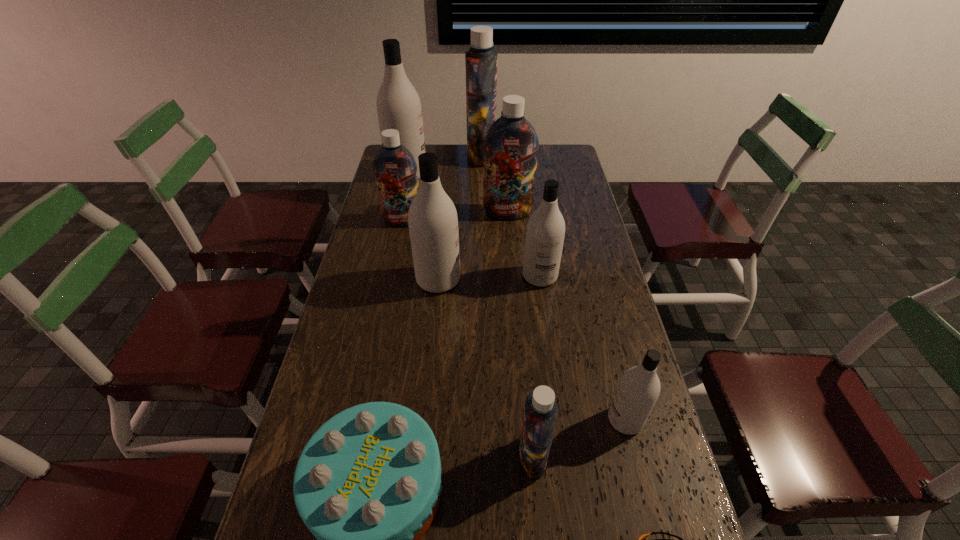
You are a GUI agent. You are given a task and a screenshot of the screen. Output one action in this format:
    pyautogui.click(x=<x>, y=<y>)
    Task: Click on the vacant space situated 0.350m on the front label of the nearest blue shampoo
    
    Given the screenshot: What is the action you would take?
    pyautogui.click(x=370, y=457)

Find the location of a particular element. This screenshot has width=960, height=540. vacant space located 0.290m on the front label of the nearest blue shampoo is located at coordinates (395, 457).

The height and width of the screenshot is (540, 960). Find the location of `vacant space situated on the front-facing side of the rightmost shampoo`. vacant space situated on the front-facing side of the rightmost shampoo is located at coordinates (551, 420).

I want to click on vacant space located 0.270m on the front-facing side of the rightmost shampoo, so click(x=499, y=420).

I want to click on vacant space located 0.400m on the front-facing side of the rightmost shampoo, so click(x=447, y=420).

This screenshot has width=960, height=540. What are the coordinates of `object that is positioned at the right edge` in the screenshot? It's located at (638, 390).

The width and height of the screenshot is (960, 540). I want to click on object present at the far left corner, so click(x=398, y=105).

The width and height of the screenshot is (960, 540). What are the coordinates of `free location at the far edge of the desktop` in the screenshot? It's located at (457, 154).

The image size is (960, 540). I want to click on vacant region at the left edge of the desktop, so click(x=356, y=284).

This screenshot has width=960, height=540. Identify the location of vacant region at the right edge. (595, 282).